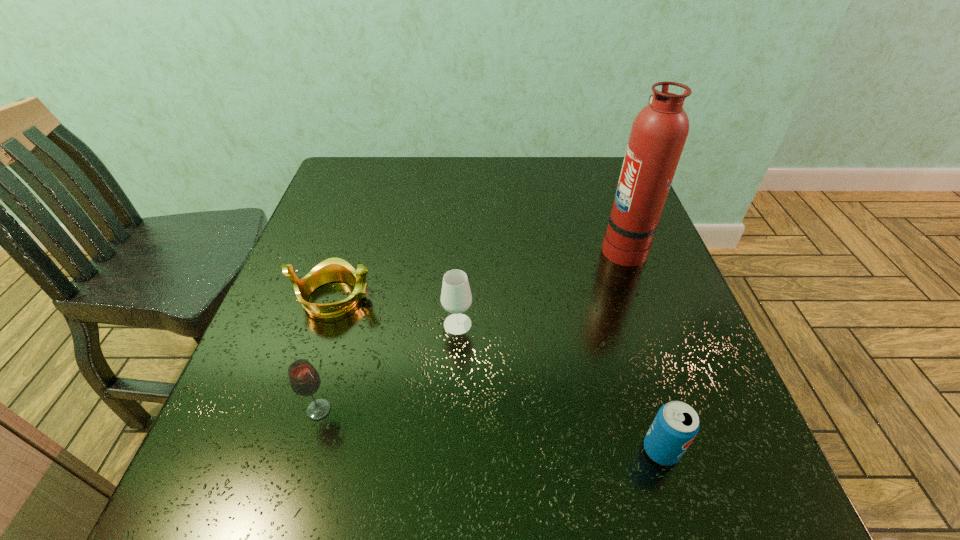
Find the location of a particular element. The image size is (960, 540). fire extinguisher is located at coordinates (658, 134).

Where is `the tallest object`? the tallest object is located at coordinates 658,134.

Identify the location of the right glass drink container. (456, 297).

Locate an element on the screen. the third object from left to right is located at coordinates (456, 297).

What are the coordinates of `the left glass drink container` in the screenshot? It's located at (304, 379).

Locate an element on the screen. The width and height of the screenshot is (960, 540). the nearer glass drink container is located at coordinates (304, 379).

The height and width of the screenshot is (540, 960). I want to click on soda can, so pyautogui.click(x=676, y=424).

Where is `tiara`? This screenshot has height=540, width=960. tiara is located at coordinates (333, 269).

Locate an element on the screen. vacant area located on the label side of the tallest object is located at coordinates (460, 247).

This screenshot has height=540, width=960. I want to click on vacant position located on the label side of the tallest object, so click(x=506, y=247).